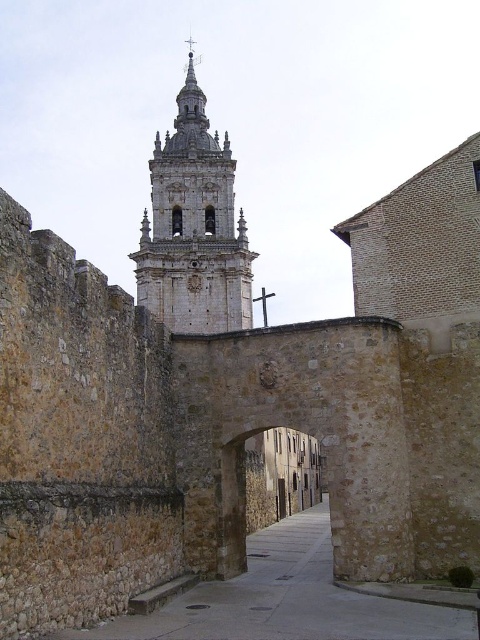
Consider the image. You are a tourist standing in front of the historic stone structure. You want to walk through the smooth stone alley at center to reach the narrow street beyond. However, you notice the white stone tower at center is in your path. Based on their positions, can you determine if you can pass through the alley without going around the tower?

The smooth stone alley at center is to the right of the white stone tower at center, so you can walk around the tower to the right to access the alley and proceed to the narrow street beyond.

You are a tourist standing at the entrance of the smooth stone alley at center. You want to reach the white stone tower at center. Which direction should you walk to get there?

The smooth stone alley at center is located below the white stone tower at center, so you should walk upwards along the smooth stone alley at center to reach the white stone tower at center.

You are a tour guide leading a group through a historic site. You want to lead your group from the smooth stone alley at center to the white stone tower at center. Can you walk through the alley while holding a large banner that is 3 meters wide?

The smooth stone alley at center has a lesser width compared to the white stone tower at center. Since the alley is narrower than the tower, and the banner is 3 meters wide, it is likely too wide to fit through the alley. The group should find an alternative route or fold the banner to a smaller size before proceeding.